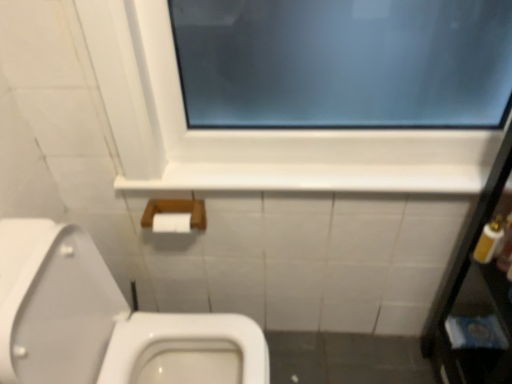
Question: From the image's perspective, is white plastic bottle at right, the first toiletry when ordered from left to right, located above or below metallic silver mirror at right?

Choices:
 (A) below
 (B) above

Answer: (B)

Question: From a real-world perspective, is white plastic bottle at right, the first toiletry when ordered from left to right, positioned above or below metallic silver mirror at right?

Choices:
 (A) below
 (B) above

Answer: (B)

Question: Estimate the real-world distances between objects in this image. Which object is farther from the white glossy toilet at lower left?

Choices:
 (A) white glossy ledge at upper center
 (B) wooden box at lower center
 (C) white plastic bottle at right, the first toiletry when ordered from left to right
 (D) white plastic bottle at right, the second toiletry from the left
 (E) metallic silver mirror at right

Answer: (D)

Question: Considering the real-world distances, which object is closest to the white plastic bottle at right, the second toiletry from the left?

Choices:
 (A) metallic silver mirror at right
 (B) white glossy ledge at upper center
 (C) white glossy toilet at lower left
 (D) wooden box at lower center
 (E) white plastic bottle at right, arranged as the 2th toiletry when viewed from the right

Answer: (E)